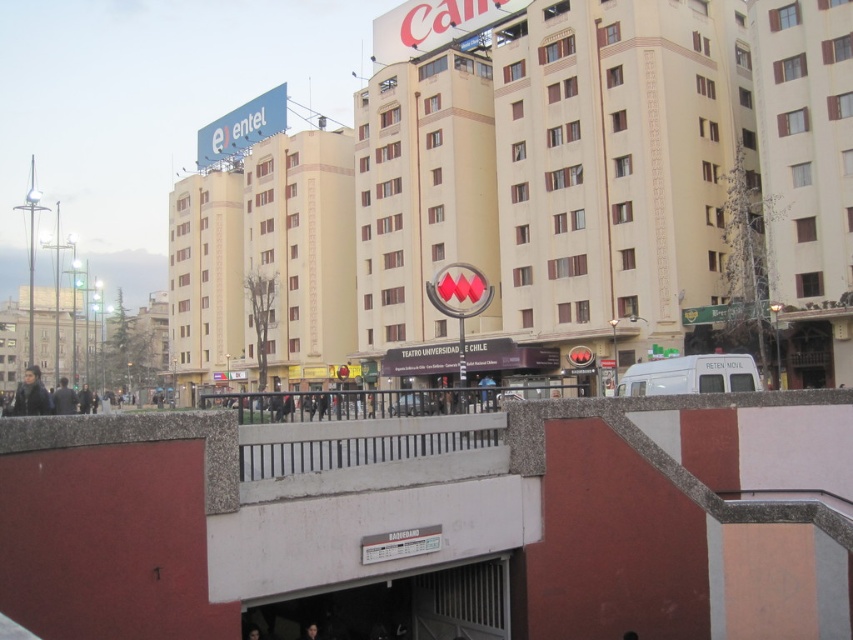
Question: Does white concrete rail at center have a greater width compared to dark brown leather jacket at lower left?

Choices:
 (A) no
 (B) yes

Answer: (A)

Question: Is beige concrete building at center to the left of dark hair at lower center from the viewer's perspective?

Choices:
 (A) yes
 (B) no

Answer: (A)

Question: Which point is farther to the camera?

Choices:
 (A) (59, 392)
 (B) (18, 396)
 (C) (366, 432)
 (D) (252, 324)

Answer: (D)

Question: Based on their relative distances, which object is farther from the dark brown leather jacket at lower left?

Choices:
 (A) dark hair at lower center
 (B) dark gray jacket at left

Answer: (A)

Question: Based on their relative distances, which object is nearer to the dark hair at lower center?

Choices:
 (A) dark brown leather jacket at lower left
 (B) white concrete rail at center
 (C) dark gray jacket at left

Answer: (B)

Question: Is dark brown leather jacket at lower left above dark gray jacket at left?

Choices:
 (A) yes
 (B) no

Answer: (A)